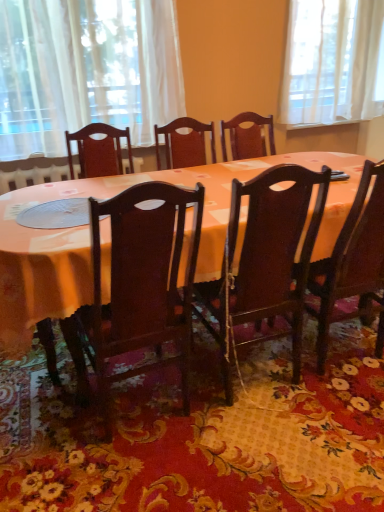
Where is `vacant space in front of dark wood chair at center, acting as the second chair starting from the right`? vacant space in front of dark wood chair at center, acting as the second chair starting from the right is located at coordinates (269, 455).